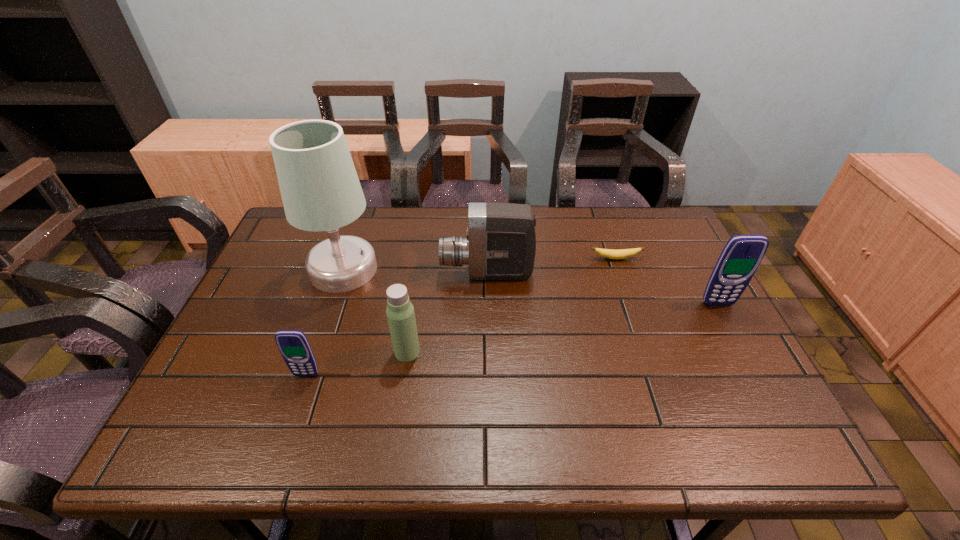
The width and height of the screenshot is (960, 540). Find the location of `vacant position in the image that satisfies the following two spatial constraints: 1. on the base of the lampshade; 2. on the right side of the third object from left to right`. vacant position in the image that satisfies the following two spatial constraints: 1. on the base of the lampshade; 2. on the right side of the third object from left to right is located at coordinates (316, 352).